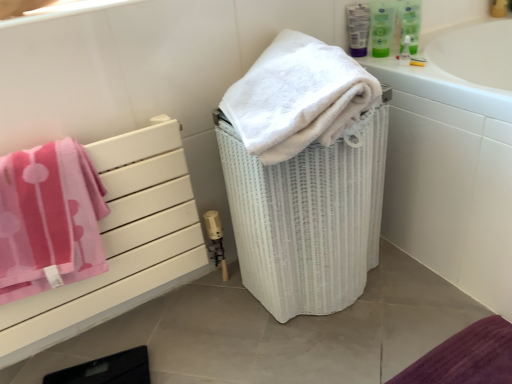
I want to click on vacant space in front of white wicker laundry basket at center, so click(347, 346).